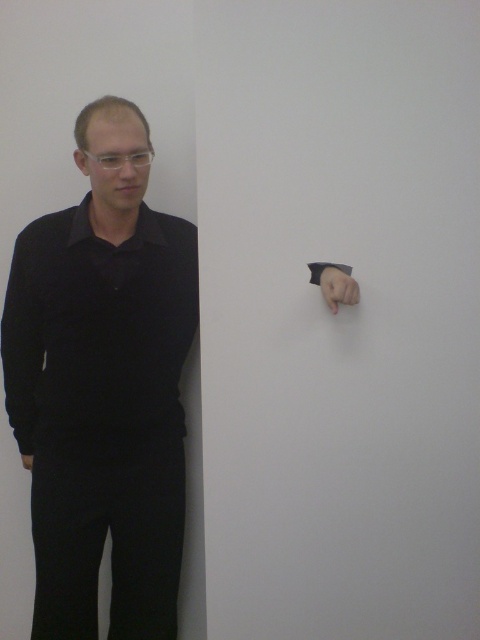
You are an interior designer analyzing the composition of the image. The scene has a person against a white wall with a point marked at coordinates (103, 387). What object is located at that point?

The point at coordinates (103, 387) marks the black matte shirt at left.

You are an interior designer analyzing the image. You need to determine which object occupies more vertical space in the scene. Which one is taller between the black smooth shirt at left and the matte black hand at upper right?

The black smooth shirt at left is much taller as matte black hand at upper right.